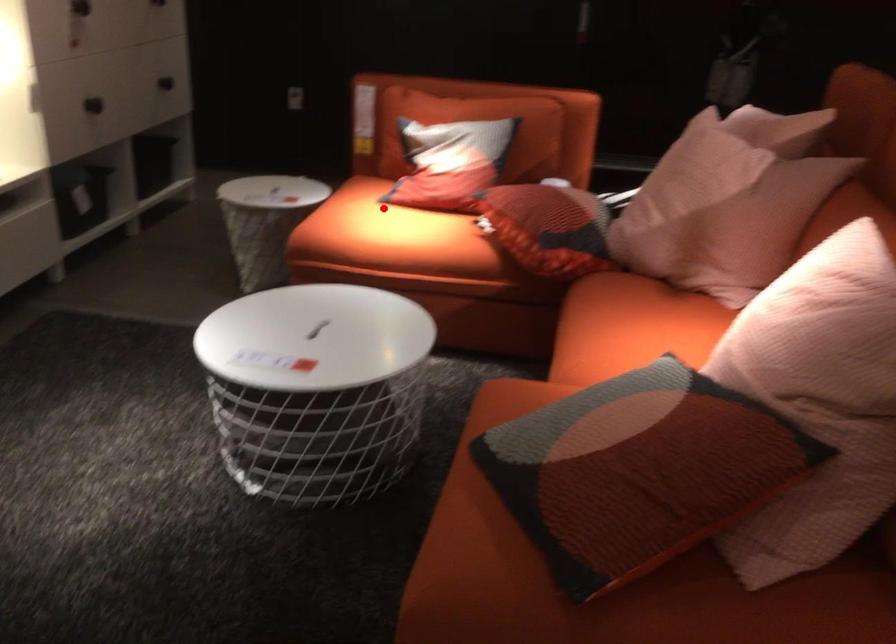
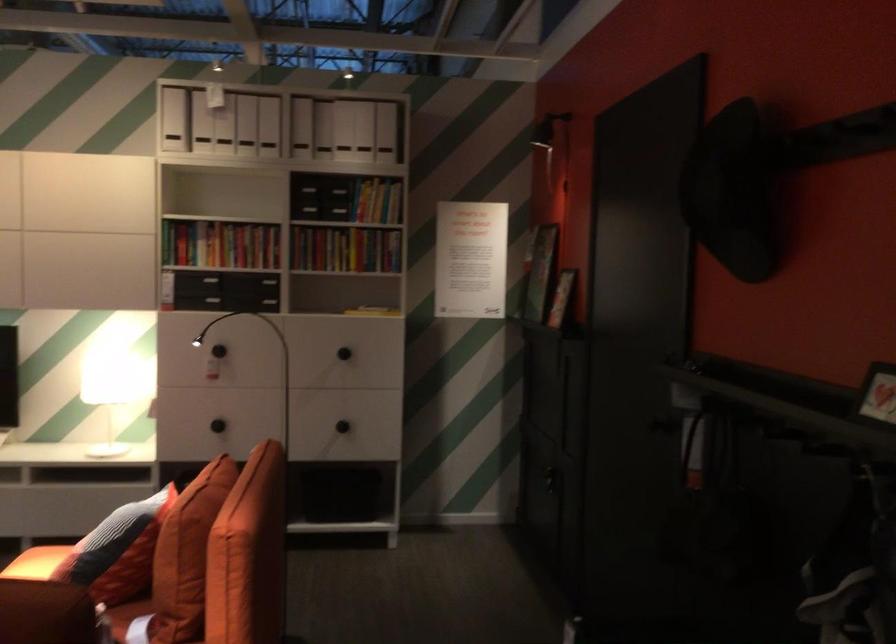
Question: I am providing you with two images of the same scene from different viewpoints. Image1 has a red point marked. In image2, the corresponding 3D location appears at what relative position? Reply with the corresponding letter.

Choices:
 (A) Closer
 (B) Farther

Answer: (A)